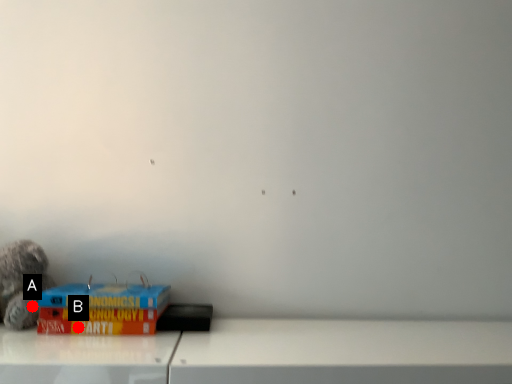
Question: Two points are circled on the image, labeled by A and B beside each circle. Which of the following is the farthest from the observer?

Choices:
 (A) A is further
 (B) B is further

Answer: (A)